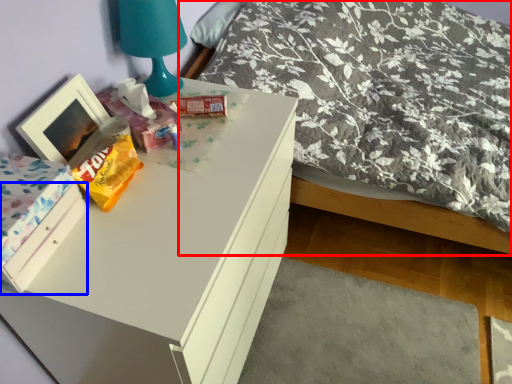
Question: Which point is closer to the camera, bed (highlighted by a red box) or drawer (highlighted by a blue box)?

Choices:
 (A) bed
 (B) drawer

Answer: (B)